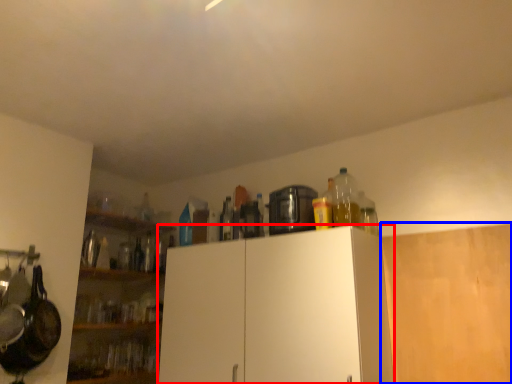
Question: Which object is further to the camera taking this photo, cabinetry (highlighted by a red box) or cabinetry (highlighted by a blue box)?

Choices:
 (A) cabinetry
 (B) cabinetry

Answer: (B)